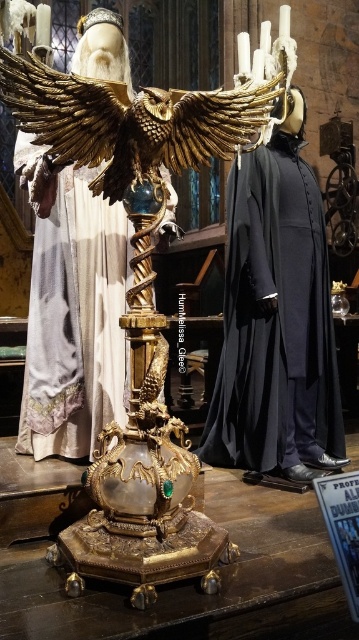
Question: Is dark blue velvet robe at center positioned at the back of gold textured eagle at center?

Choices:
 (A) yes
 (B) no

Answer: (A)

Question: Is the position of dark blue velvet robe at center more distant than that of gold textured eagle at center?

Choices:
 (A) yes
 (B) no

Answer: (A)

Question: Which point is farther to the camera?

Choices:
 (A) gold textured eagle at center
 (B) dark blue velvet robe at center

Answer: (B)

Question: Can you confirm if dark blue velvet robe at center is bigger than gold textured eagle at center?

Choices:
 (A) no
 (B) yes

Answer: (A)

Question: Which point is farther from the camera taking this photo?

Choices:
 (A) (66, 136)
 (B) (241, 289)

Answer: (B)